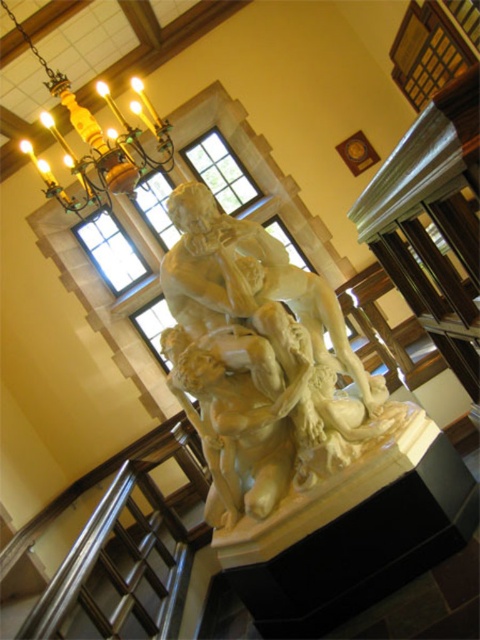
Question: Can you confirm if white marble sculpture at center is smaller than gold polished metal chandelier at upper left?

Choices:
 (A) no
 (B) yes

Answer: (A)

Question: Which object is farther from the camera taking this photo?

Choices:
 (A) gold polished metal chandelier at upper left
 (B) white marble sculpture at center

Answer: (A)

Question: Observing the image, what is the correct spatial positioning of white marble sculpture at center in reference to gold polished metal chandelier at upper left?

Choices:
 (A) left
 (B) right

Answer: (B)

Question: Does white marble sculpture at center appear over gold polished metal chandelier at upper left?

Choices:
 (A) no
 (B) yes

Answer: (A)

Question: Which point appears farthest from the camera in this image?

Choices:
 (A) (152, 160)
 (B) (357, 444)

Answer: (A)

Question: Which of the following is the closest to the observer?

Choices:
 (A) gold polished metal chandelier at upper left
 (B) white marble sculpture at center

Answer: (B)